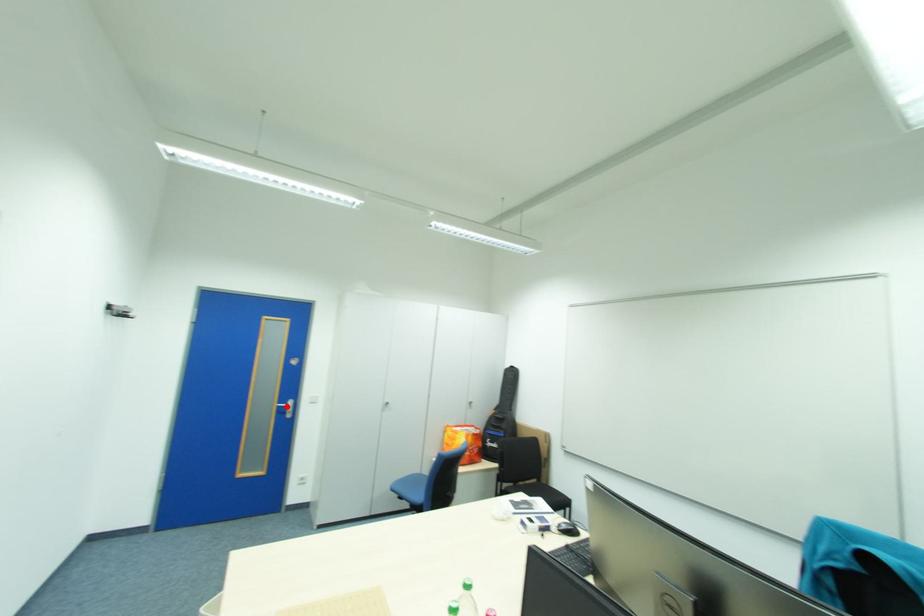
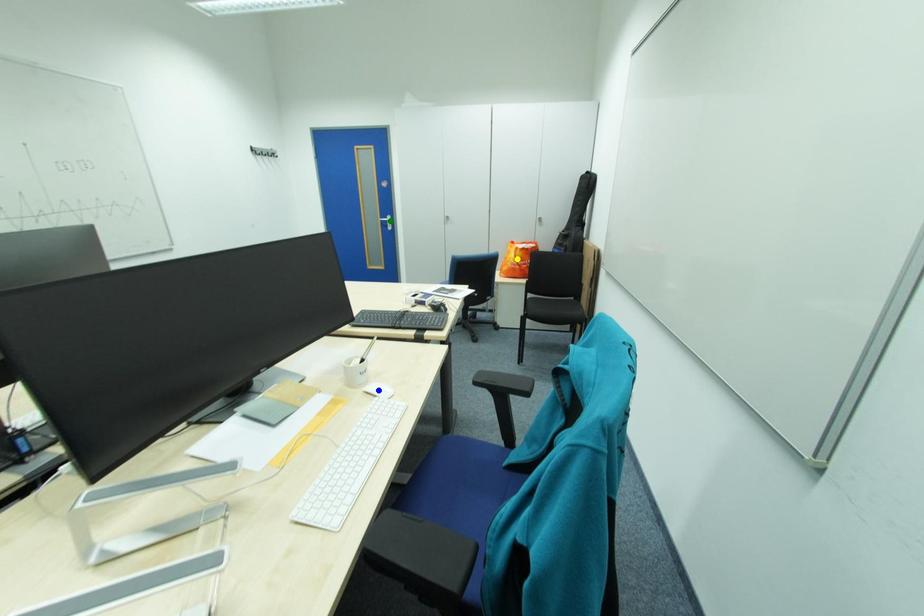
Question: I am providing you with two images of the same scene from different viewpoints. A red point is marked on the first image. You are given multiple points on the second image. Which point in image 2 represents the same 3d spot as the red point in image 1?

Choices:
 (A) green point
 (B) yellow point
 (C) blue point

Answer: (A)